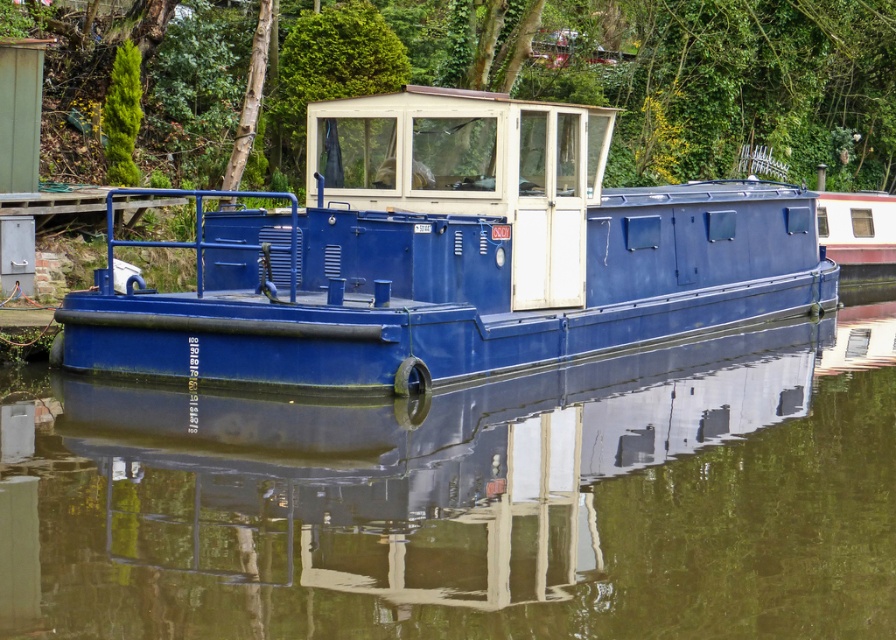
You are standing on the dock next to the glossy blue boat at center. You want to walk to the end of the dock, which is 10 meters away from your current position. If the distance between you and the boat is 7.22 meters, how much farther do you need to walk to reach the dock end beyond the boat?

The distance between you and the glossy blue boat at center is 7.22 meters. To reach the dock end 10 meters away, subtract the 7.22 meters to the boat from the total distance, resulting in 2.78 meters remaining. Therefore, you need to walk an additional 2.78 meters beyond the glossy blue boat at center to reach the dock end.

You are standing on the dock and see the point marked at coordinates (x=468, y=500). What object is located at that point?

The point at coordinates (x=468, y=500) indicates the glossy blue boat at center.

You are standing on the dock and want to take a photo of both the matte blue boat at center and the green leafy tree at upper center. Which object should you focus on first to ensure both are in clear view?

You should focus on the matte blue boat at center first because it is closer to you than the green leafy tree at upper center, ensuring both are in clear view when focusing on the nearer object first.